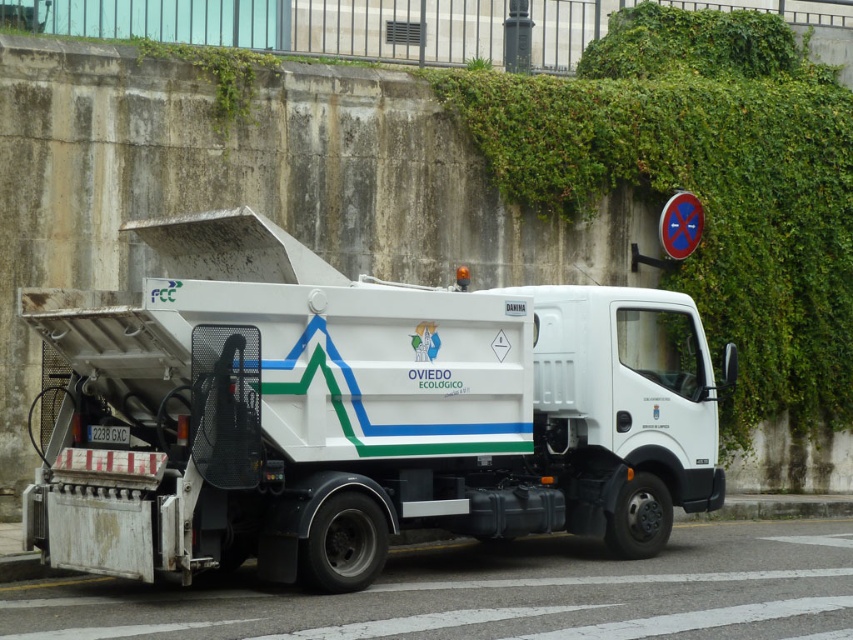
Question: Considering the real-world distances, which object is closest to the green leafy ivy at upper right?

Choices:
 (A) white matte truck at center
 (B) metallic blue circle at upper right

Answer: (B)

Question: Which object appears closest to the camera in this image?

Choices:
 (A) white matte truck at center
 (B) green leafy ivy at upper right
 (C) metallic blue circle at upper right

Answer: (A)

Question: Is green leafy ivy at upper right wider than metallic blue circle at upper right?

Choices:
 (A) yes
 (B) no

Answer: (B)

Question: Can you confirm if white matte truck at center is positioned below metallic blue circle at upper right?

Choices:
 (A) no
 (B) yes

Answer: (B)

Question: Which point appears closest to the camera in this image?

Choices:
 (A) (833, 292)
 (B) (251, 323)
 (C) (685, 252)

Answer: (B)

Question: Is green leafy ivy at upper right thinner than metallic blue circle at upper right?

Choices:
 (A) yes
 (B) no

Answer: (A)